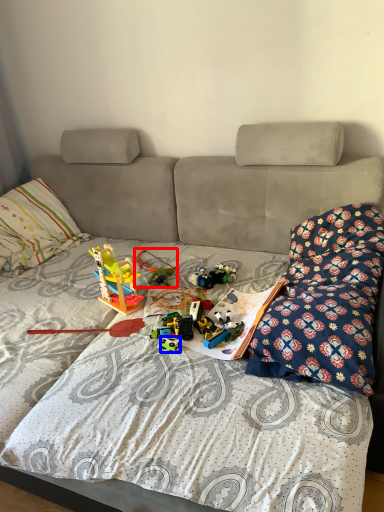
Question: Which point is closer to the camera, toy (highlighted by a red box) or toy (highlighted by a blue box)?

Choices:
 (A) toy
 (B) toy

Answer: (B)